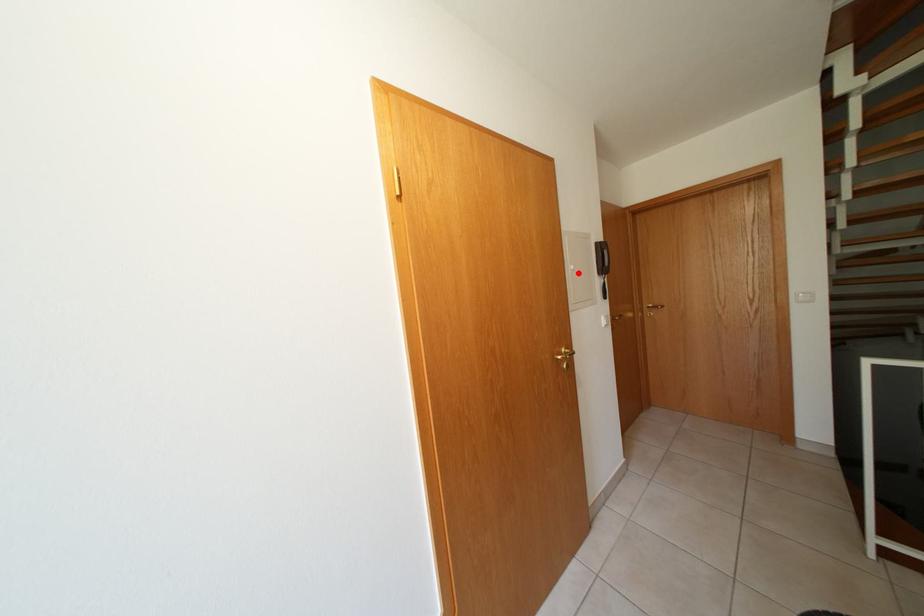
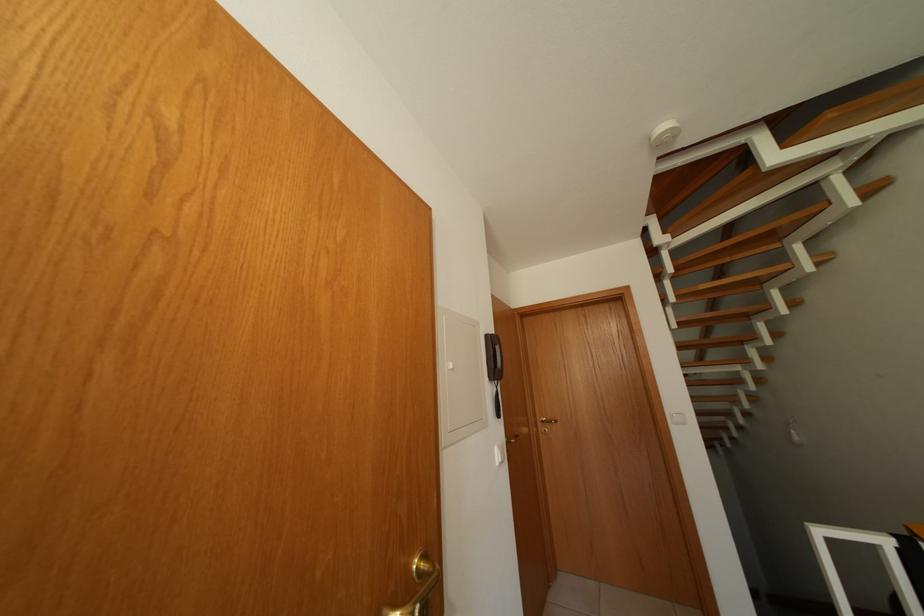
Find the pixel in the second image that matches the highlighted location in the first image.

(455, 371)